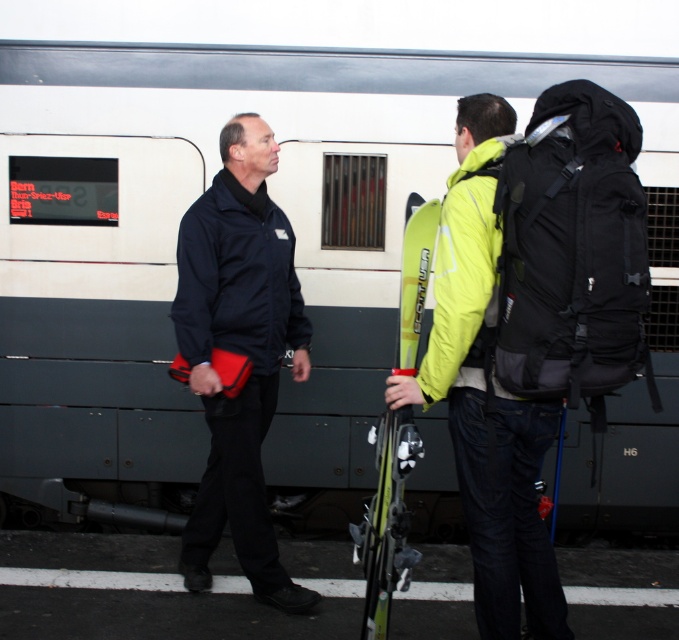
Question: Which object is farther from the camera taking this photo?

Choices:
 (A) neon yellow jacket at center
 (B) yellow matte ski at center
 (C) black matte jacket at center

Answer: (C)

Question: Is the position of black matte jacket at center more distant than that of neon yellow jacket at center?

Choices:
 (A) yes
 (B) no

Answer: (A)

Question: Which point is closer to the camera taking this photo?

Choices:
 (A) (411, 323)
 (B) (187, 314)
 (C) (454, 337)

Answer: (C)

Question: Can you confirm if black matte jacket at center is positioned above neon yellow jacket at center?

Choices:
 (A) yes
 (B) no

Answer: (A)

Question: Which point is farther to the camera?

Choices:
 (A) black matte jacket at center
 (B) yellow matte ski at center
 (C) neon yellow jacket at center

Answer: (A)

Question: Can you confirm if black matte jacket at center is wider than neon yellow jacket at center?

Choices:
 (A) no
 (B) yes

Answer: (A)